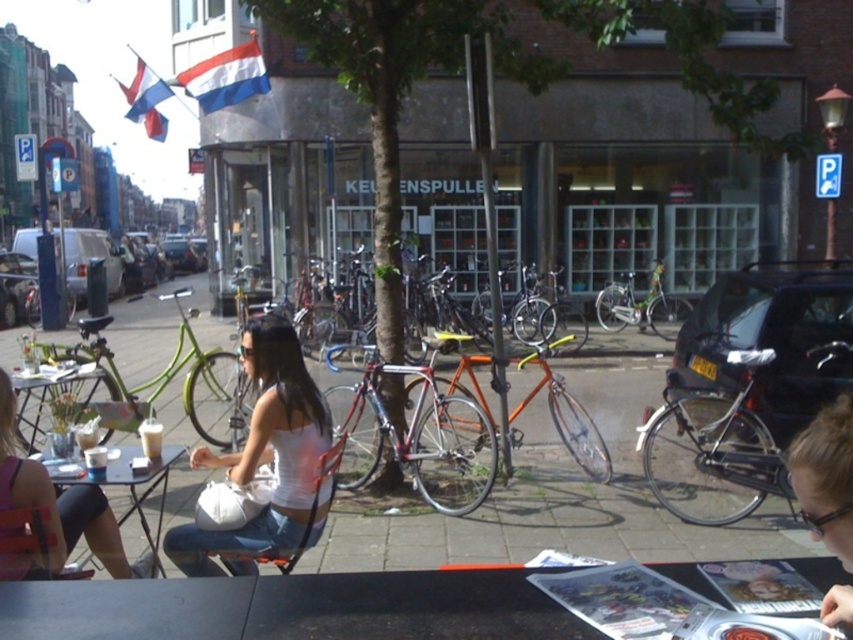
Does green matte bicycle at center lie behind matte black table at lower left?

Yes, green matte bicycle at center is further from the viewer.

The image size is (853, 640). Describe the element at coordinates (641, 305) in the screenshot. I see `green matte bicycle at center` at that location.

You are a GUI agent. You are given a task and a screenshot of the screen. Output one action in this format:
    pyautogui.click(x=<x>, y=<y>)
    Task: Click on the green matte bicycle at center
    The width and height of the screenshot is (853, 640).
    Given the screenshot: What is the action you would take?
    pyautogui.click(x=641, y=305)

Locate an element on the screen. This screenshot has height=640, width=853. green matte bicycle at center is located at coordinates (641, 305).

Based on the photo, does green matte bicycle at left come behind green matte bicycle at center?

No, it is in front of green matte bicycle at center.

Which is more to the left, green matte bicycle at left or green matte bicycle at center?

Positioned to the left is green matte bicycle at left.

You are a GUI agent. You are given a task and a screenshot of the screen. Output one action in this format:
    pyautogui.click(x=<x>, y=<y>)
    Task: Click on the green matte bicycle at left
    The image size is (853, 640).
    Given the screenshot: What is the action you would take?
    pyautogui.click(x=161, y=381)

Who is higher up, orange metallic bicycle at center or matte black table at lower left?

Positioned higher is matte black table at lower left.

Identify the location of orange metallic bicycle at center. (547, 404).